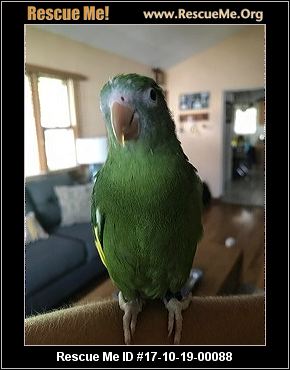
Identify the location of couch. This screenshot has width=290, height=370. (58, 243).